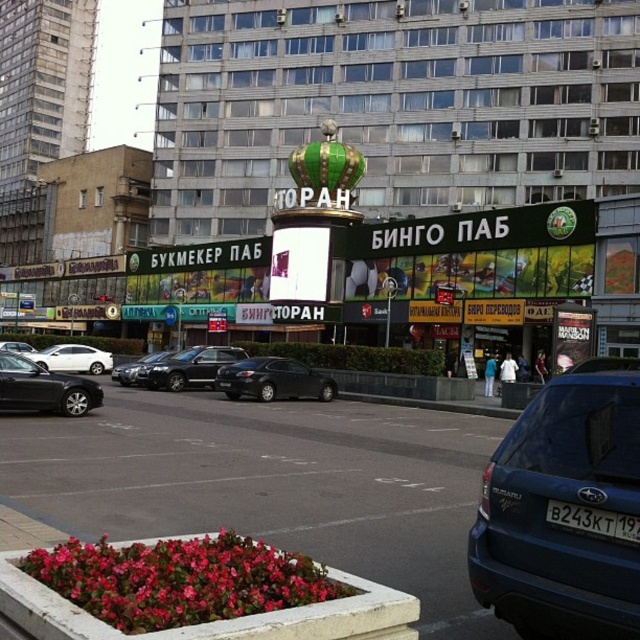
The image size is (640, 640). Find the location of `blue matte suv at lower right`. blue matte suv at lower right is located at coordinates (563, 513).

Can you confirm if blue matte suv at lower right is positioned below satin black car at center?

Actually, blue matte suv at lower right is above satin black car at center.

Is point (611, 461) in front of point (195, 364)?

Yes.

The image size is (640, 640). Find the location of `blue matte suv at lower right`. blue matte suv at lower right is located at coordinates (563, 513).

Can you confirm if shiny black sedan at left is positioned below shiny silver sedan at center?

Actually, shiny black sedan at left is above shiny silver sedan at center.

Is shiny black sedan at left in front of shiny silver sedan at center?

Yes, it is in front of shiny silver sedan at center.

Identify the location of shiny black sedan at left. (44, 388).

Does point (493, 474) come farther from viewer compared to point (627, 528)?

Yes, point (493, 474) is farther from viewer.

Is point (516, 449) farther from viewer compared to point (600, 515)?

Yes, point (516, 449) is farther from viewer.

I want to click on blue matte suv at lower right, so click(563, 513).